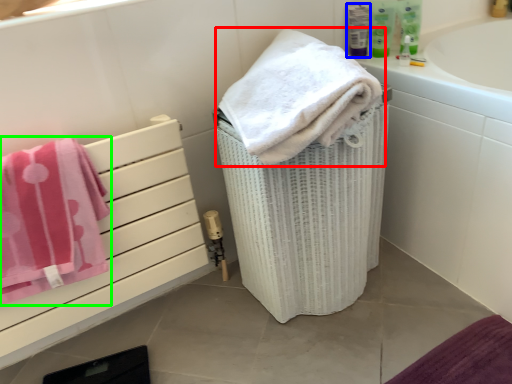
Question: Which object is positioned farthest from towel (highlighted by a red box)? Select from mouthwash (highlighted by a blue box) and towel (highlighted by a green box).

Choices:
 (A) mouthwash
 (B) towel

Answer: (A)